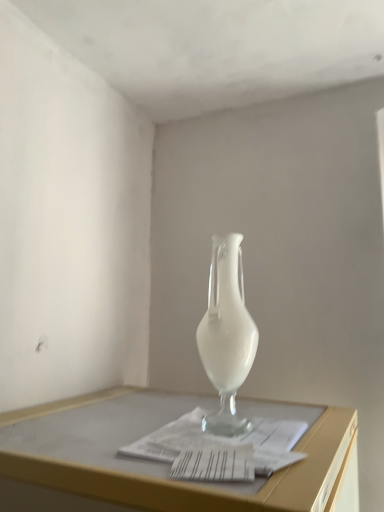
Question: From a real-world perspective, is white glass vase at center below white paper at center?

Choices:
 (A) yes
 (B) no

Answer: (B)

Question: Can we say white glass vase at center lies outside white paper at center?

Choices:
 (A) yes
 (B) no

Answer: (A)

Question: Is white glass vase at center wider than white paper at center?

Choices:
 (A) no
 (B) yes

Answer: (A)

Question: From a real-world perspective, does white glass vase at center stand above white paper at center?

Choices:
 (A) no
 (B) yes

Answer: (B)

Question: Does white glass vase at center lie in front of white paper at center?

Choices:
 (A) no
 (B) yes

Answer: (A)

Question: Can you confirm if white glass vase at center is positioned to the right of white paper at center?

Choices:
 (A) yes
 (B) no

Answer: (A)

Question: Is white paper at center closer to camera compared to white glass vase at center?

Choices:
 (A) no
 (B) yes

Answer: (B)

Question: Is white paper at center smaller than white glass vase at center?

Choices:
 (A) no
 (B) yes

Answer: (B)

Question: Is white paper at center touching white glass vase at center?

Choices:
 (A) yes
 (B) no

Answer: (B)

Question: Can you confirm if white paper at center is shorter than white glass vase at center?

Choices:
 (A) no
 (B) yes

Answer: (B)

Question: Is white paper at center aimed at white glass vase at center?

Choices:
 (A) no
 (B) yes

Answer: (A)

Question: Is white paper at center looking in the opposite direction of white glass vase at center?

Choices:
 (A) yes
 (B) no

Answer: (B)

Question: Considering the positions of white paper at center and white glass vase at center in the image, is white paper at center bigger or smaller than white glass vase at center?

Choices:
 (A) big
 (B) small

Answer: (B)